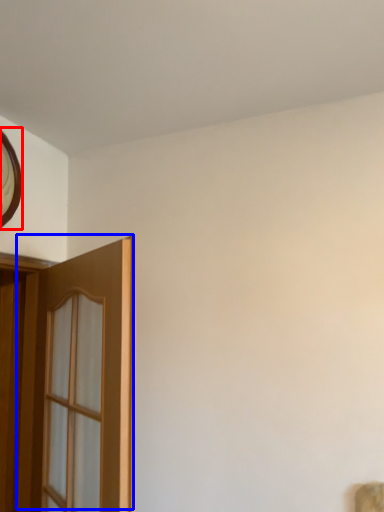
Question: Which object appears farthest to the camera in this image, clock (highlighted by a red box) or door (highlighted by a blue box)?

Choices:
 (A) clock
 (B) door

Answer: (A)